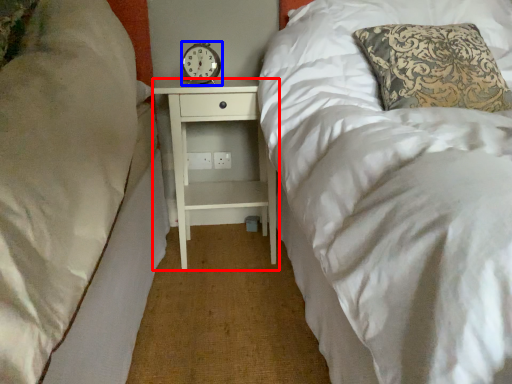
Question: Which of the following is the farthest to the observer, nightstand (highlighted by a red box) or clock (highlighted by a blue box)?

Choices:
 (A) nightstand
 (B) clock

Answer: (B)